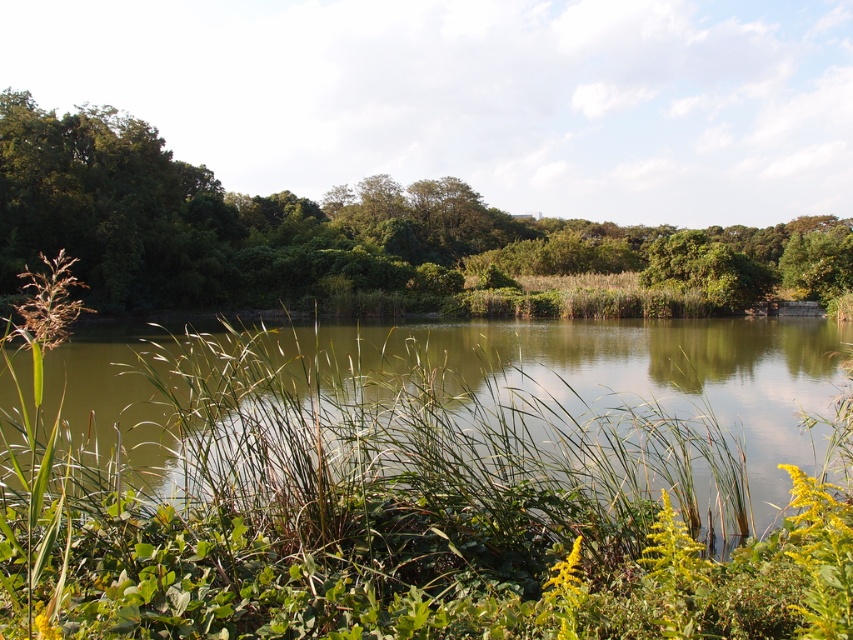
In the scene shown: You are standing at the edge of the scene and want to walk from the green grassy river at center to the green leafy tree at center. Which direction should you move?

You should move to the right to reach the green leafy tree at center from the green grassy river at center since the green grassy river at center is positioned to the left of the green leafy tree at center.

You are standing at the edge of the green grassy river at center and want to look up to see the green leafy tree at center. In which direction should you look?

You should look upward because the green grassy river at center is below the green leafy tree at center.

You are standing at the edge of the scene and want to cross to the other side. There is a green grassy river at center. Can you walk directly across the river? Explain your reasoning based on the scene description.

The green grassy river at center is located at coordinates point (456, 413), which is centrally positioned in the scene. Since the river is described as a grassy area, it is likely a shallow or dried part of the riverbed, making it possible to walk across. However, the scene mentions the water is calm and reflective, so the actual water might still be present. To safely cross, one should check the depth and firmness of the grassy area before proceeding.